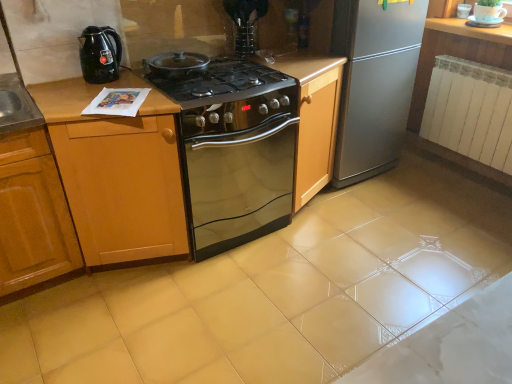
What do you see at coordinates (374, 83) in the screenshot? I see `silver metallic refrigerator at right` at bounding box center [374, 83].

In order to click on silver metallic refrigerator at right in this screenshot , I will do pyautogui.click(x=374, y=83).

Locate an element on the screen. The height and width of the screenshot is (384, 512). wooden cabinet at left, which appears as the second cabinetry when viewed from the right is located at coordinates (33, 214).

Identify the location of white wood countertop at upper right. The image size is (512, 384). (471, 30).

At what (x,y) coordinates should I click in order to perform the action: click on white glossy cup at upper right, which is the 2th appliance from bottom to top. Please return your answer as a coordinate pair (x, y). Looking at the image, I should click on (463, 11).

Where is `stainless steel oven at center`? stainless steel oven at center is located at coordinates (234, 151).

Where is `clear glass vase at upper center, which is the 2th appliance from right to left`? clear glass vase at upper center, which is the 2th appliance from right to left is located at coordinates (245, 22).

In order to face black glass cooktop at center, should I rotate leftwards or rightwards?

You should look left and rotate roughly 9.126 degrees.

The height and width of the screenshot is (384, 512). I want to click on silver metallic refrigerator at right, so point(374,83).

From a real-world perspective, which appliance is the 2nd one above the wooden cabinet at center, the second cabinetry when ordered from left to right? Please provide its 2D coordinates.

[(245, 22)]

Does point (244, 29) come in front of point (108, 192)?

No, it is not.

Considering the sizes of clear glass vase at upper center, which is the 2th appliance from right to left, and wooden cabinet at center, the first cabinetry when ordered from right to left, in the image, is clear glass vase at upper center, which is the 2th appliance from right to left, taller or shorter than wooden cabinet at center, the first cabinetry when ordered from right to left,?

In the image, clear glass vase at upper center, which is the 2th appliance from right to left, appears to be shorter than wooden cabinet at center, the first cabinetry when ordered from right to left.

From a real-world perspective, between clear glass vase at upper center, the 1th appliance when ordered from front to back, and wooden cabinet at center, the second cabinetry when ordered from left to right, who is vertically higher?

clear glass vase at upper center, the 1th appliance when ordered from front to back, from a real-world perspective.

There is a black glass cooktop at center. Where is `the 1st cabinetry below it (from a real-world perspective)`? This screenshot has width=512, height=384. the 1st cabinetry below it (from a real-world perspective) is located at coordinates (123, 187).

From the image's perspective, is wooden cabinet at center, the first cabinetry when ordered from right to left, located above black glass cooktop at center?

No, from the image's perspective, wooden cabinet at center, the first cabinetry when ordered from right to left, is not over black glass cooktop at center.

Considering the relative sizes of wooden cabinet at center, the second cabinetry when ordered from left to right, and black glass cooktop at center in the image provided, is wooden cabinet at center, the second cabinetry when ordered from left to right, bigger than black glass cooktop at center?

Yes, wooden cabinet at center, the second cabinetry when ordered from left to right, is bigger than black glass cooktop at center.

Does wooden cabinet at center, the first cabinetry when ordered from right to left, have a lesser width compared to black glass cooktop at center?

In fact, wooden cabinet at center, the first cabinetry when ordered from right to left, might be wider than black glass cooktop at center.

How many degrees apart are the facing directions of white wood countertop at upper right and wooden cabinet at left, the 1th cabinetry in the left-to-right sequence?

The facing directions of white wood countertop at upper right and wooden cabinet at left, the 1th cabinetry in the left-to-right sequence, are 89.4 degrees apart.

The width and height of the screenshot is (512, 384). I want to click on the 2nd cabinetry located beneath the white wood countertop at upper right (from a real-world perspective), so click(x=33, y=214).

Looking at this image, from the image's perspective, is white wood countertop at upper right on wooden cabinet at left, the 1th cabinetry in the left-to-right sequence?

Yes, from the image's perspective, white wood countertop at upper right is over wooden cabinet at left, the 1th cabinetry in the left-to-right sequence.

From a real-world perspective, who is located higher, silver metallic refrigerator at right or white glossy cup at upper right, the first appliance positioned from the back?

From a 3D spatial view, white glossy cup at upper right, the first appliance positioned from the back, is above.

Is silver metallic refrigerator at right not inside white glossy cup at upper right, placed as the first appliance when sorted from top to bottom?

Indeed, silver metallic refrigerator at right is completely outside white glossy cup at upper right, placed as the first appliance when sorted from top to bottom.

From the picture: Is silver metallic refrigerator at right facing away from white glossy cup at upper right, placed as the first appliance when sorted from top to bottom?

silver metallic refrigerator at right is not turned away from white glossy cup at upper right, placed as the first appliance when sorted from top to bottom.

Between silver metallic refrigerator at right and white glossy cup at upper right, the second appliance from the left, which one has larger size?

silver metallic refrigerator at right.

From the picture: Who is taller, wooden cabinet at center, the second cabinetry when ordered from left to right, or white wood countertop at upper right?

With more height is wooden cabinet at center, the second cabinetry when ordered from left to right.

Which point is more forward, (64, 142) or (441, 21)?

The point (64, 142) is closer.

From the image's perspective, count 1st cabinetrys downward from the white wood countertop at upper right and point to it. Please provide its 2D coordinates.

[(123, 187)]

From a real-world perspective, is white metallic radiator at right located higher than stainless steel oven at center?

Indeed, from a real-world perspective, white metallic radiator at right stands above stainless steel oven at center.

From the picture: Is white metallic radiator at right turned away from stainless steel oven at center?

No, white metallic radiator at right's orientation is not away from stainless steel oven at center.

Consider the image. From the image's perspective, which object appears higher, white metallic radiator at right or stainless steel oven at center?

white metallic radiator at right is shown above in the image.

The width and height of the screenshot is (512, 384). In order to click on appliance that is the 2nd one above the white wood countertop at upper right (from a real-world perspective) in this screenshot , I will do `click(245, 22)`.

Is white wood countertop at upper right wider or thinner than clear glass vase at upper center, positioned as the first appliance in bottom-to-top order?

In the image, white wood countertop at upper right appears to be wider than clear glass vase at upper center, positioned as the first appliance in bottom-to-top order.

Is white wood countertop at upper right located outside clear glass vase at upper center, the 2th appliance viewed from the back?

Indeed, white wood countertop at upper right is completely outside clear glass vase at upper center, the 2th appliance viewed from the back.

Is white wood countertop at upper right taller than clear glass vase at upper center, the 2th appliance viewed from the back?

In fact, white wood countertop at upper right may be shorter than clear glass vase at upper center, the 2th appliance viewed from the back.

Image resolution: width=512 pixels, height=384 pixels. Identify the location of the 1st appliance above the wooden cabinet at center, the second cabinetry when ordered from left to right (from the image's perspective). (245, 22).

Locate an element on the screen. gas stove above the wooden cabinet at center, the second cabinetry when ordered from left to right (from a real-world perspective) is located at coordinates (222, 83).

Estimate the real-world distances between objects in this image. Which object is further from white metallic radiator at right, clear glass vase at upper center, the 2th appliance viewed from the back, or wooden cabinet at center, the second cabinetry when ordered from left to right?

Among the two, wooden cabinet at center, the second cabinetry when ordered from left to right, is located further to white metallic radiator at right.

Which object lies nearer to the anchor point clear glass vase at upper center, which is the 2th appliance from right to left, wooden cabinet at center, the second cabinetry when ordered from left to right, or white wood countertop at upper right?

Among the two, wooden cabinet at center, the second cabinetry when ordered from left to right, is located nearer to clear glass vase at upper center, which is the 2th appliance from right to left.

Which object lies further to the anchor point clear glass vase at upper center, positioned as the first appliance in bottom-to-top order, wooden cabinet at left, which appears as the second cabinetry when viewed from the right, or black glass cooktop at center?

wooden cabinet at left, which appears as the second cabinetry when viewed from the right, is further to clear glass vase at upper center, positioned as the first appliance in bottom-to-top order.

Based on their spatial positions, is white metallic radiator at right or black glass cooktop at center closer to wooden cabinet at center, the first cabinetry when ordered from right to left?

The object closer to wooden cabinet at center, the first cabinetry when ordered from right to left, is black glass cooktop at center.

Considering their positions, is white wood countertop at upper right positioned further to black glass cooktop at center than white metallic radiator at right?

Based on the image, white wood countertop at upper right appears to be further to black glass cooktop at center.

From the picture: Which object lies further to the anchor point silver metallic refrigerator at right, white wood countertop at upper right or white glossy cup at upper right, which is the 1th appliance from right to left?

The object further to silver metallic refrigerator at right is white glossy cup at upper right, which is the 1th appliance from right to left.

Consider the image. When comparing their distances from clear glass vase at upper center, the 1th appliance viewed from the left, does white metallic radiator at right or white glossy cup at upper right, the second appliance from the left, seem closer?

Based on the image, white metallic radiator at right appears to be nearer to clear glass vase at upper center, the 1th appliance viewed from the left.

Looking at the image, which one is located closer to wooden cabinet at left, the 1th cabinetry in the left-to-right sequence, wooden cabinet at center, the first cabinetry when ordered from right to left, or black glass cooktop at center?

wooden cabinet at center, the first cabinetry when ordered from right to left, lies closer to wooden cabinet at left, the 1th cabinetry in the left-to-right sequence, than the other object.

The height and width of the screenshot is (384, 512). What are the coordinates of `oven between black glossy electric kettle at left and white metallic radiator at right from left to right` in the screenshot? It's located at (234, 151).

At what (x,y) coordinates should I click in order to perform the action: click on gas stove between clear glass vase at upper center, the 2th appliance viewed from the back, and wooden cabinet at center, the second cabinetry when ordered from left to right, vertically. Please return your answer as a coordinate pair (x, y). This screenshot has width=512, height=384. Looking at the image, I should click on (222, 83).

At what (x,y) coordinates should I click in order to perform the action: click on cabinetry between wooden cabinet at left, which appears as the second cabinetry when viewed from the right, and black glass cooktop at center. Please return your answer as a coordinate pair (x, y). This screenshot has height=384, width=512. Looking at the image, I should click on (123, 187).

This screenshot has height=384, width=512. Identify the location of gas stove situated between wooden cabinet at center, the second cabinetry when ordered from left to right, and silver metallic refrigerator at right from left to right. (222, 83).